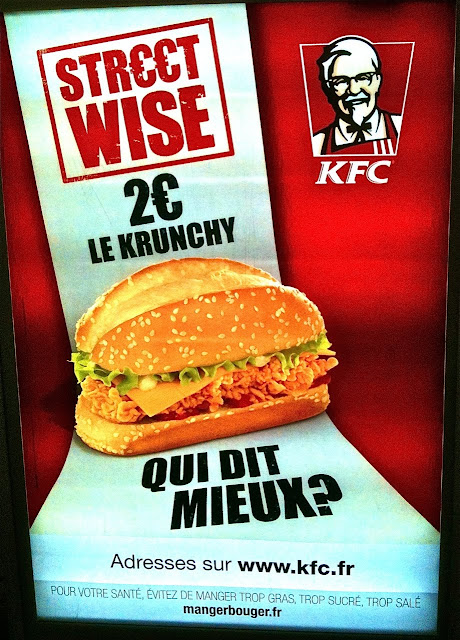
This screenshot has width=460, height=640. Find the location of `blue table`. blue table is located at coordinates (121, 500).